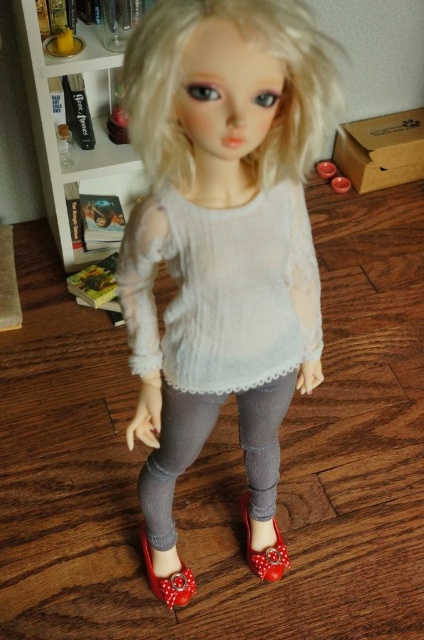
Based on the photo, you are a customer trying to decide between the shiny red sandal at lower center and the shiny red fabric shoe at lower center. Which one is wider?

The shiny red sandal at lower center is wider than the shiny red fabric shoe at lower center.

You are a child looking to put on your shoes. You see the shiny red sandal at lower center and the shiny red fabric shoe at lower center. Which one is closer to the floor?

The shiny red sandal at lower center is closer to the floor because it is located below the shiny red fabric shoe at lower center.